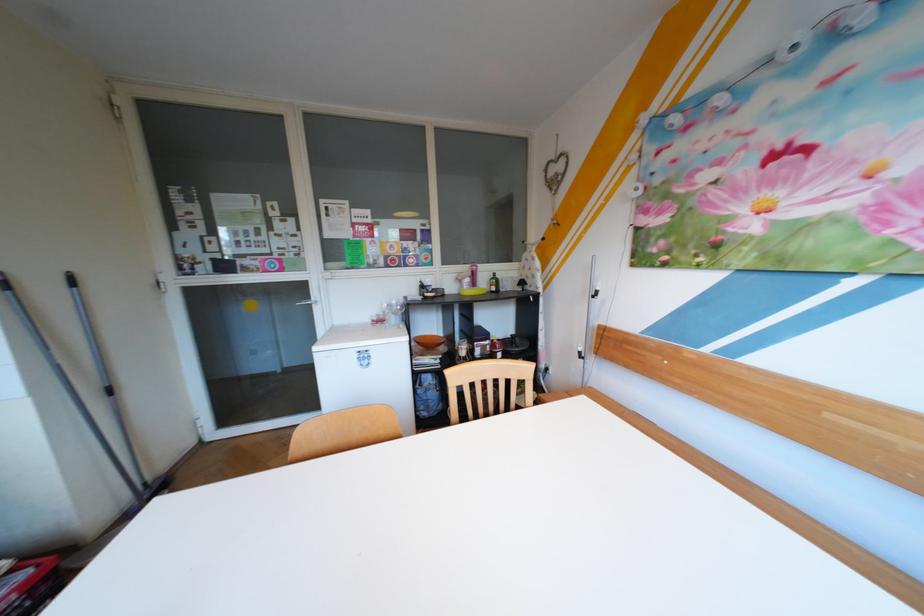
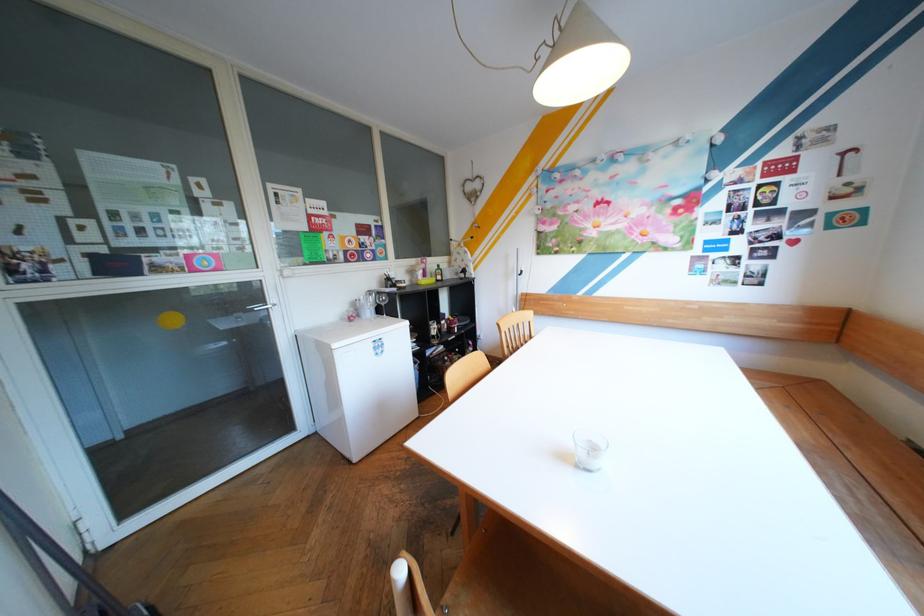
In the second image, find the point that corresponds to pixel 419 298 in the first image.

(383, 292)